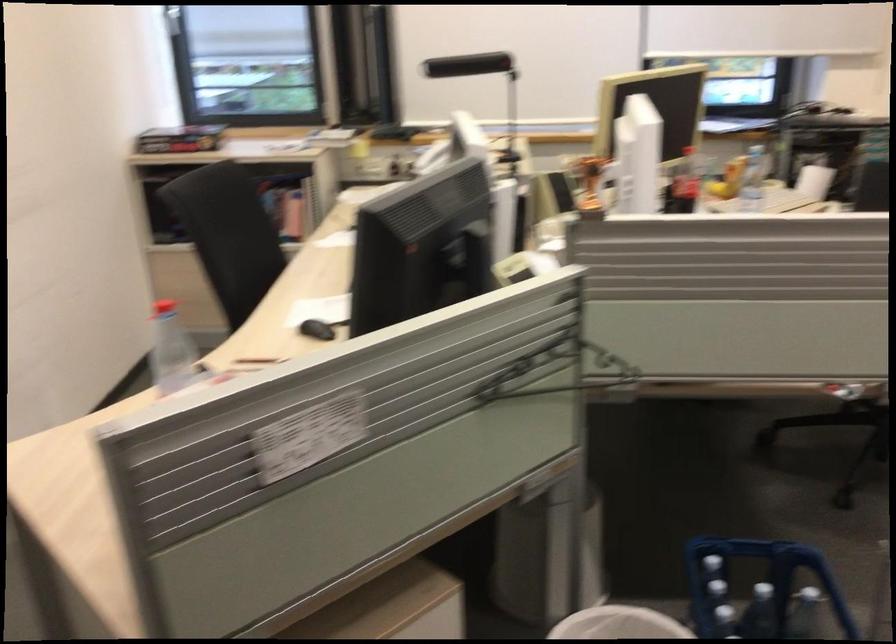
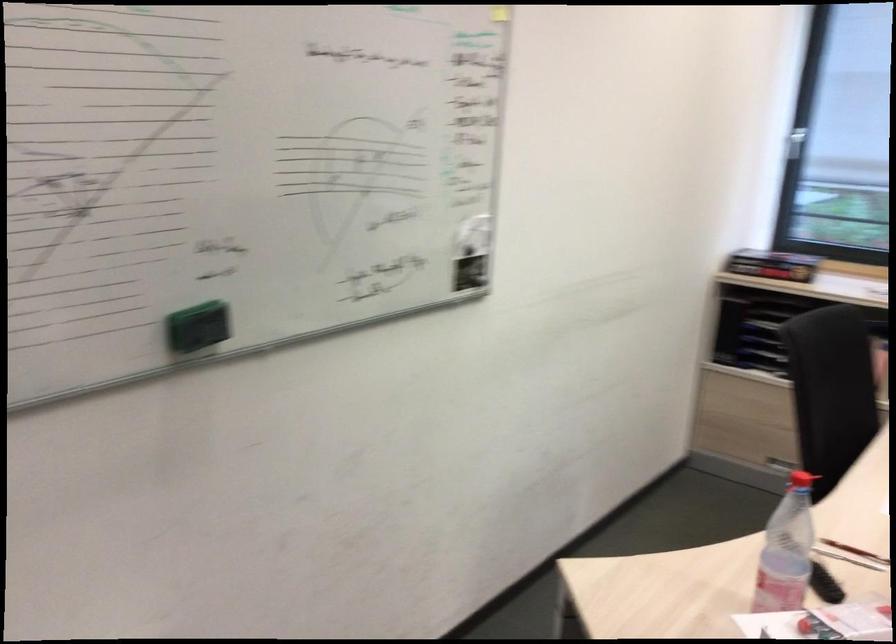
Question: The first image is from the beginning of the video and the second image is from the end. How did the camera likely rotate when shooting the video?

Choices:
 (A) Left
 (B) Right
 (C) Up
 (D) Down

Answer: (A)